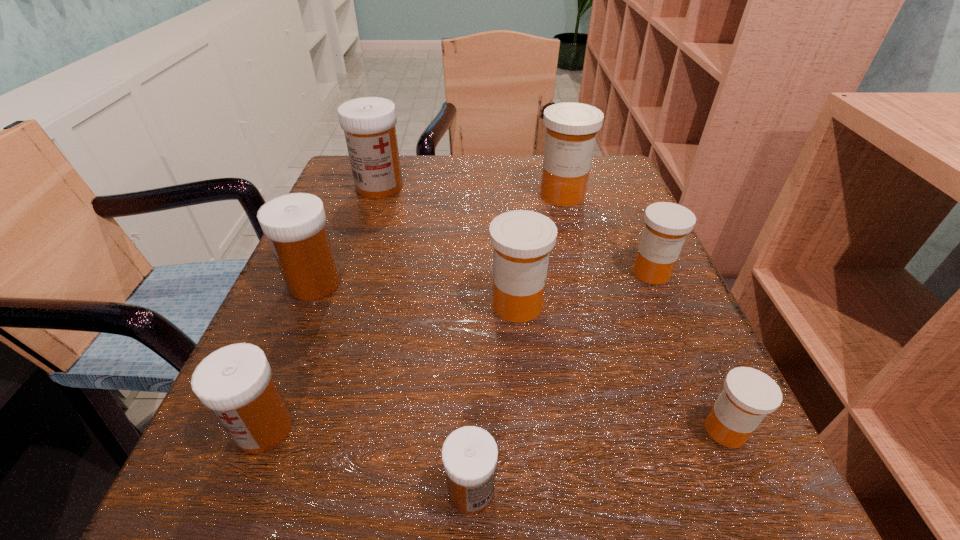
This screenshot has width=960, height=540. In the image, there is a desktop. Identify the location of free space at the far right corner. (606, 209).

Find the location of `free space at the near right corner of the desktop`. free space at the near right corner of the desktop is located at coordinates (656, 492).

The image size is (960, 540). What are the coordinates of `empty location between the second biggest white medicine and the third farthest white medicine` in the screenshot? It's located at (290, 356).

The image size is (960, 540). Find the location of `free space between the biggest orange medicine and the nearest medicine`. free space between the biggest orange medicine and the nearest medicine is located at coordinates (516, 343).

Locate an element on the screen. empty location between the third farthest white medicine and the second biggest orange medicine is located at coordinates (391, 367).

You are a GUI agent. You are given a task and a screenshot of the screen. Output one action in this format:
    pyautogui.click(x=<x>, y=<y>)
    Task: Click on the free space between the second smallest white medicine and the nearest orange medicine
    This screenshot has height=540, width=960.
    Given the screenshot: What is the action you would take?
    pyautogui.click(x=494, y=429)

This screenshot has height=540, width=960. I want to click on blank region between the nearest orange medicine and the third smallest white medicine, so click(520, 356).

You are a GUI agent. You are given a task and a screenshot of the screen. Output one action in this format:
    pyautogui.click(x=<x>, y=<y>)
    Task: Click on the vacant area that lies between the third smallest orange medicine and the third biggest white medicine
    The width and height of the screenshot is (960, 540).
    Given the screenshot: What is the action you would take?
    (391, 367)

Image resolution: width=960 pixels, height=540 pixels. What are the coordinates of `blank region between the nearest medicine and the nearest orange medicine` in the screenshot? It's located at (598, 460).

You are a GUI agent. You are given a task and a screenshot of the screen. Output one action in this format:
    pyautogui.click(x=<x>, y=<y>)
    Task: Click on the free spot between the farthest white medicine and the third nearest white medicine
    
    Given the screenshot: What is the action you would take?
    pyautogui.click(x=348, y=235)